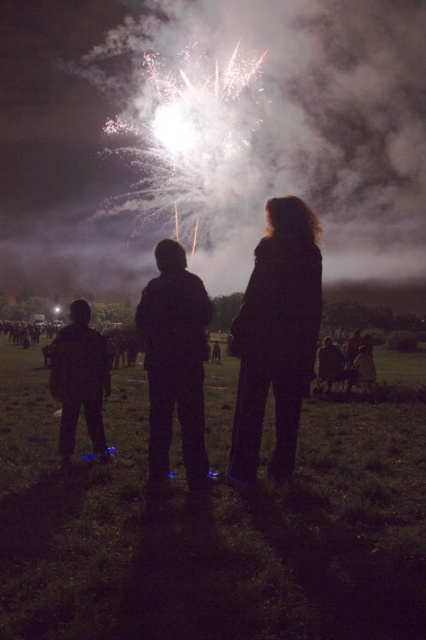
Question: Is black fabric pants at lower center wider than black matte jacket at center?

Choices:
 (A) yes
 (B) no

Answer: (A)

Question: Which object appears closest to the camera in this image?

Choices:
 (A) dark fabric coat at center
 (B) dark blue jeans at lower left

Answer: (A)

Question: Is black matte jacket at center in front of dark blue jeans at lower left?

Choices:
 (A) yes
 (B) no

Answer: (A)

Question: Is black fabric pants at lower center wider than dark fabric coat at center?

Choices:
 (A) yes
 (B) no

Answer: (A)

Question: Which object appears closest to the camera in this image?

Choices:
 (A) dark fabric coat at center
 (B) black matte jacket at center
 (C) black fabric pants at lower center

Answer: (C)

Question: Which point is farther to the camera?

Choices:
 (A) dark blue jeans at lower left
 (B) black fabric pants at lower center
 (C) black matte jacket at center

Answer: (A)